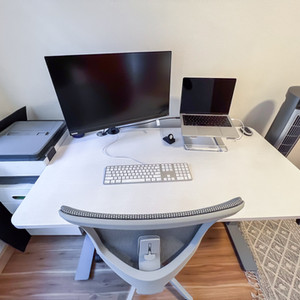
Where is `large monitor`? large monitor is located at coordinates (130, 102).